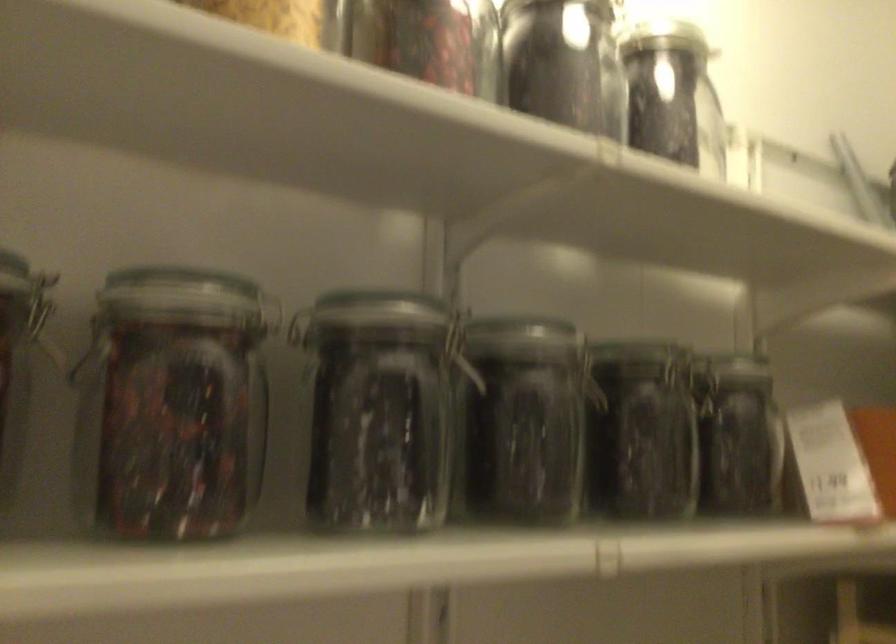
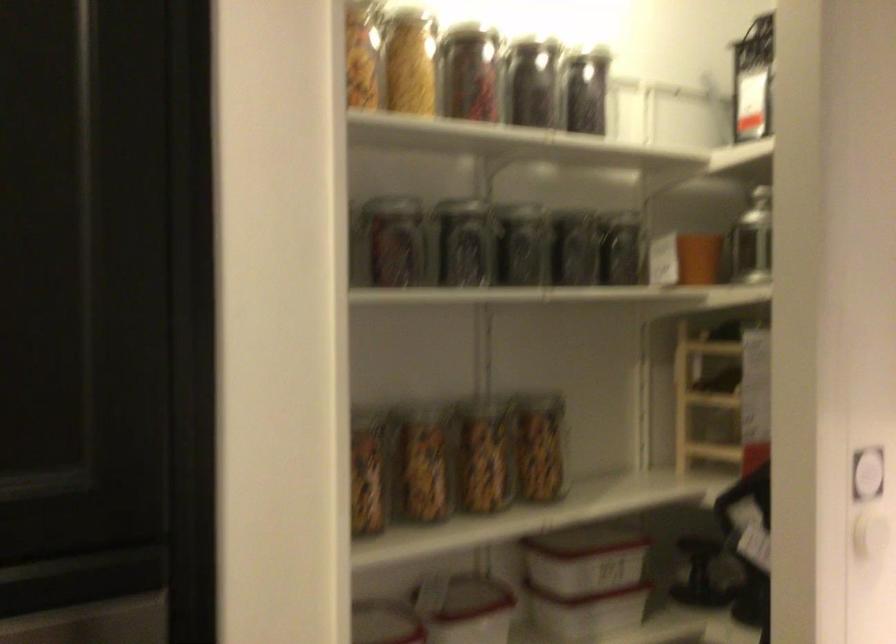
The point at (650, 100) is marked in the first image. Where is the corresponding point in the second image?

(586, 90)